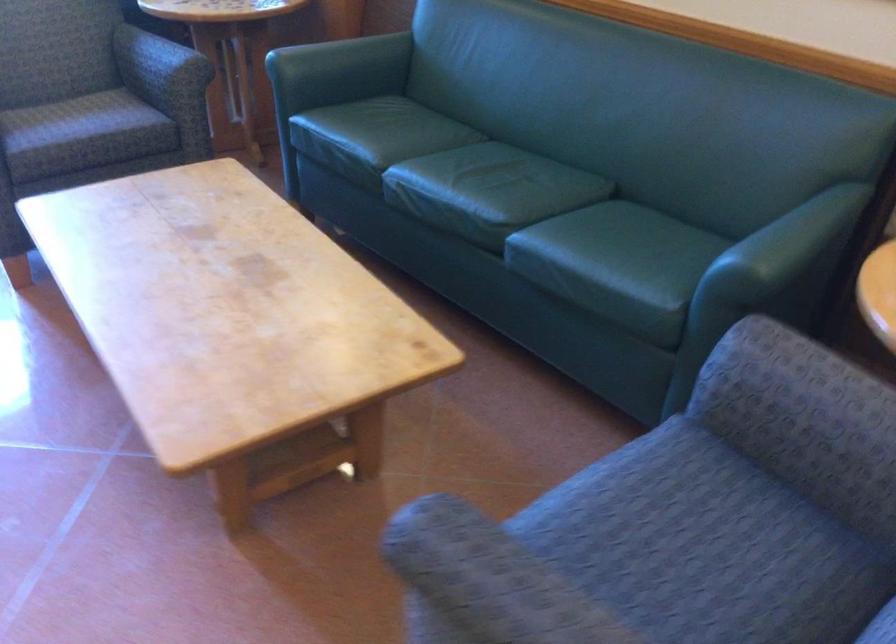
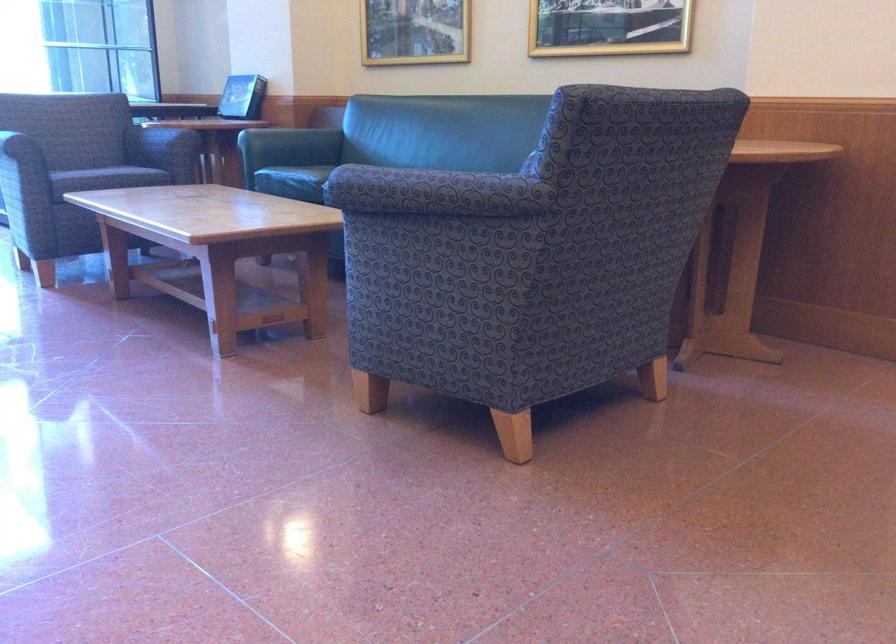
Question: I am providing you with two images of the same scene from different viewpoints. After the viewpoint changes to image2, which objects are now occluded?

Choices:
 (A) folded beige blanket
 (B) sofa sitting surface
 (C) patterned chair armrest
 (D) chair sitting surface

Answer: (C)